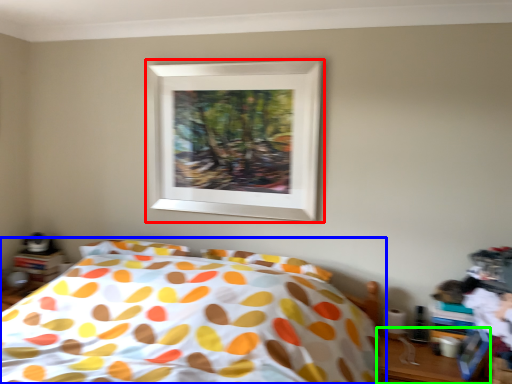
Question: Which is nearer to the picture frame (highlighted by a red box)? bed (highlighted by a blue box) or table (highlighted by a green box).

Choices:
 (A) bed
 (B) table

Answer: (A)